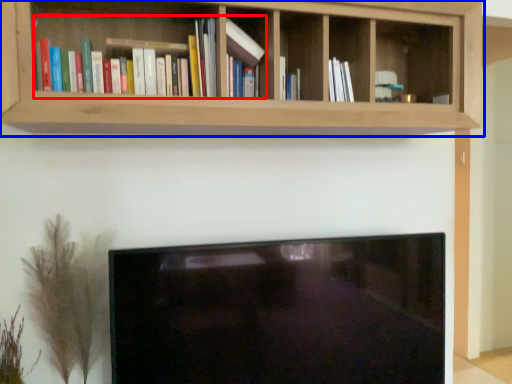
Question: Which object is closer to the camera taking this photo, book (highlighted by a red box) or shelf (highlighted by a blue box)?

Choices:
 (A) book
 (B) shelf

Answer: (B)